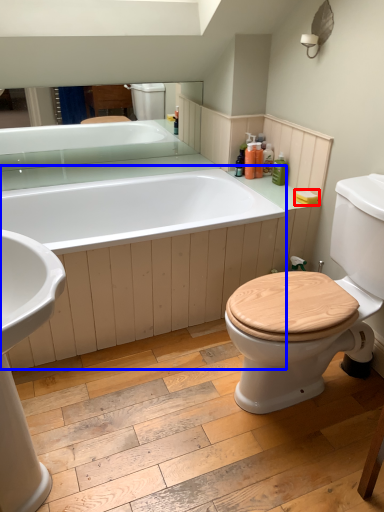
Question: Which of the following is the closest to the observer, toilet paper (highlighted by a red box) or bath (highlighted by a blue box)?

Choices:
 (A) toilet paper
 (B) bath

Answer: (B)